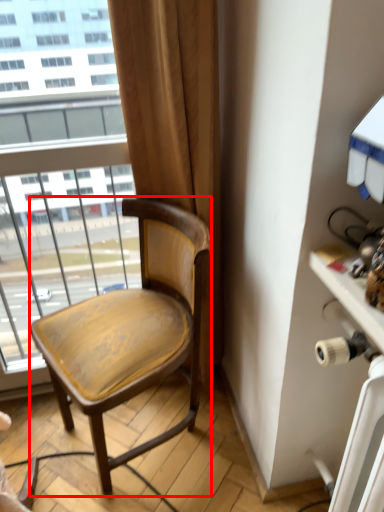
Question: From the image's perspective, what is the correct spatial positioning of chair (annotated by the red box) in reference to table?

Choices:
 (A) above
 (B) below

Answer: (A)